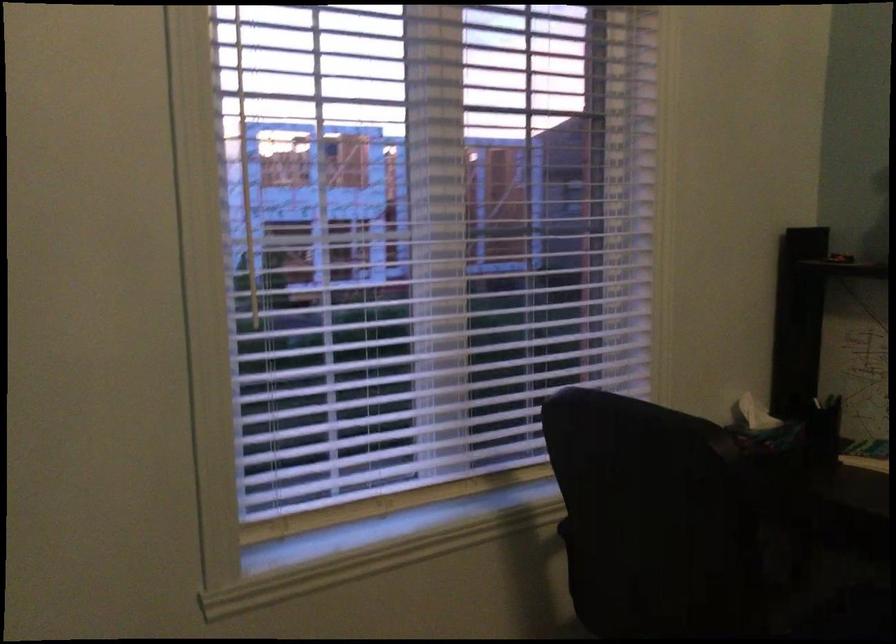
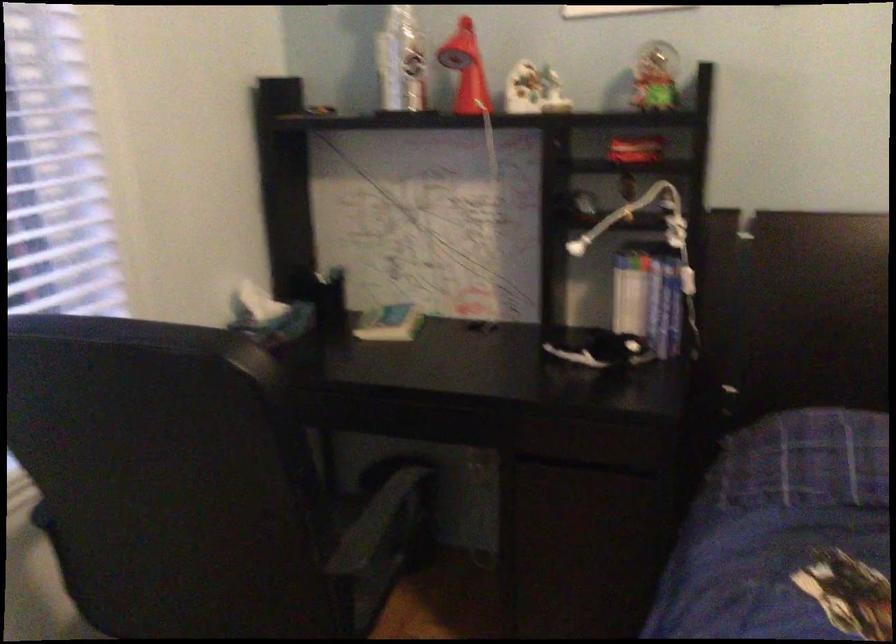
Question: The camera is either moving clockwise (left) or counter-clockwise (right) around the object. The first image is from the beginning of the video and the second image is from the end. Is the camera moving left or right when shooting the video?

Choices:
 (A) Left
 (B) Right

Answer: (A)